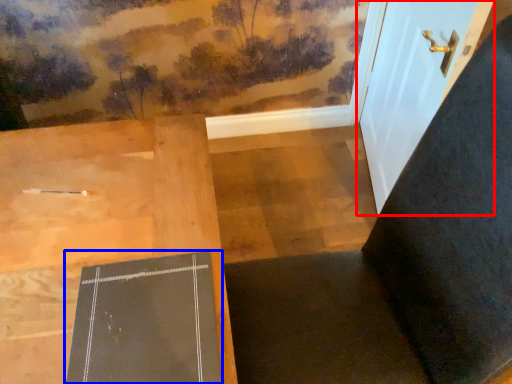
Question: Which point is closer to the camera, door (highlighted by a red box) or bulletin board (highlighted by a blue box)?

Choices:
 (A) door
 (B) bulletin board

Answer: (B)